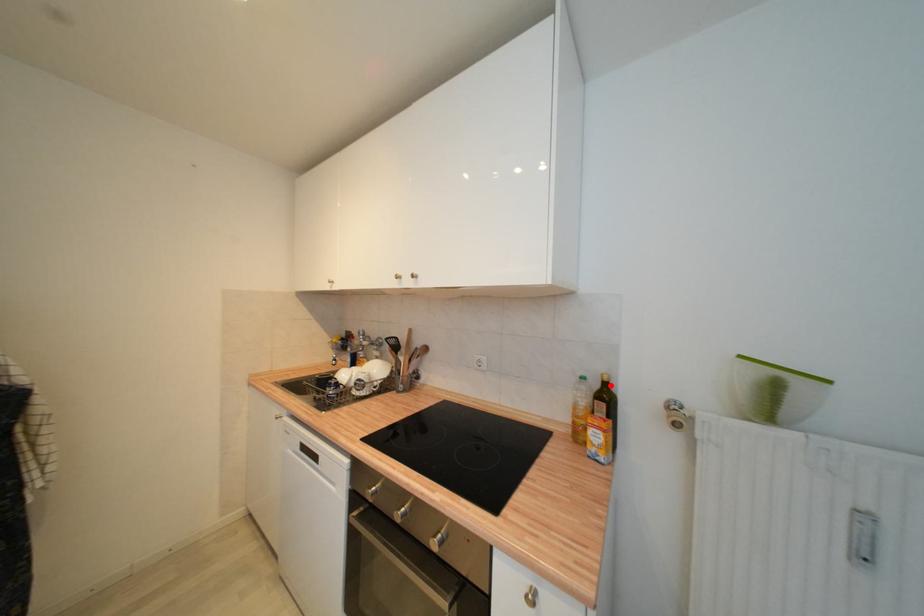
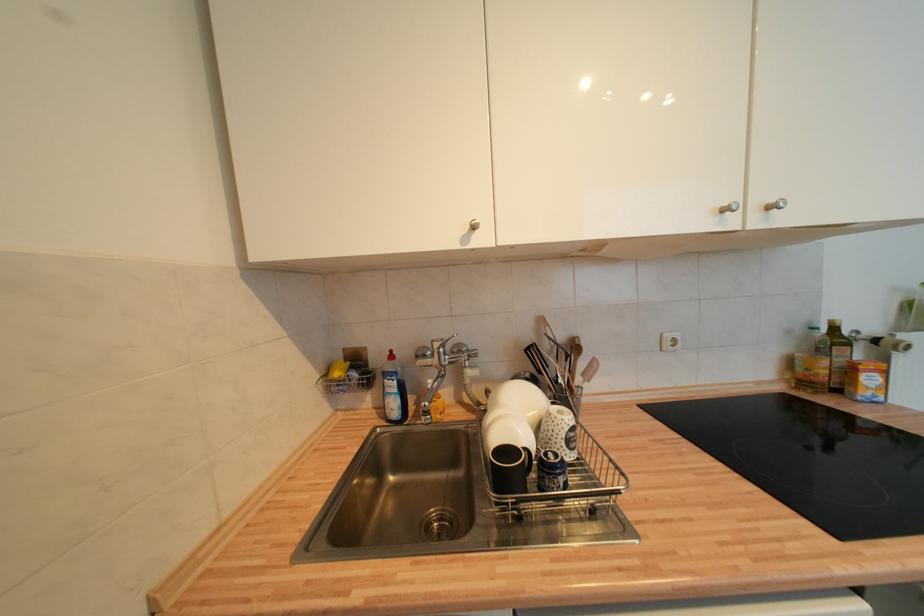
Where in the second image is the point corresponding to the highlighted location from the first image?

(840, 331)